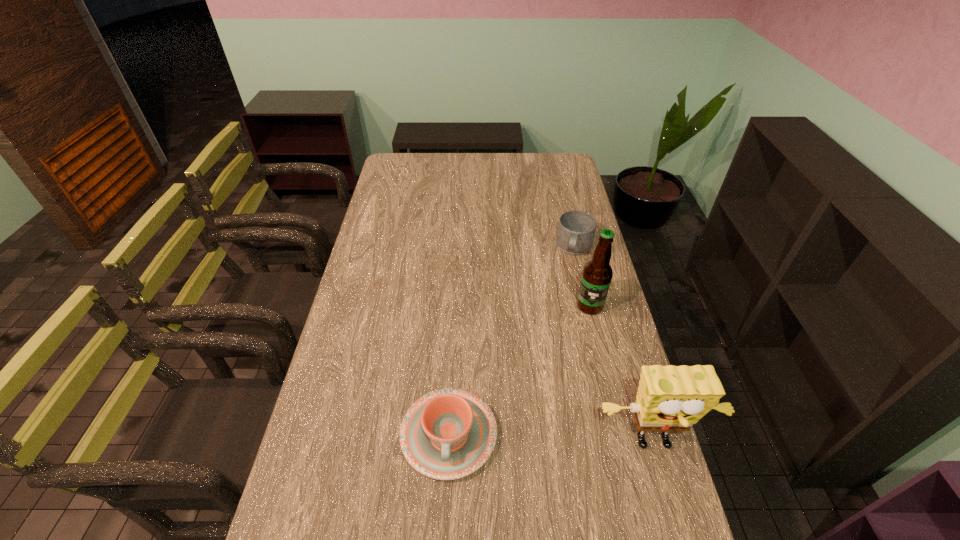
Identify which object is the third nearest to the beer bottle. Please provide its 2D coordinates. Your answer should be formatted as a tuple, i.e. [(x, y)], where the tuple contains the x and y coordinates of a point satisfying the conditions above.

[(447, 434)]

Select which object appears as the third closest to the chinaware. Please provide its 2D coordinates. Your answer should be formatted as a tuple, i.e. [(x, y)], where the tuple contains the x and y coordinates of a point satisfying the conditions above.

[(576, 230)]

At what (x,y) coordinates should I click in order to perform the action: click on vacant point that satisfies the following two spatial constraints: 1. on the front side of the second farthest object; 2. on the left side of the farthest object. Please return your answer as a coordinate pair (x, y). The image size is (960, 540). Looking at the image, I should click on (588, 306).